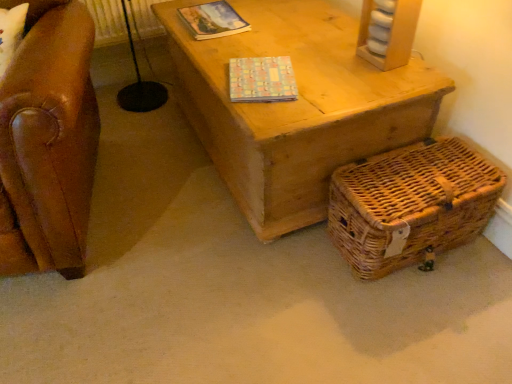
Identify the location of vacant region to the left of woven brown basket at lower right. The image size is (512, 384). (290, 276).